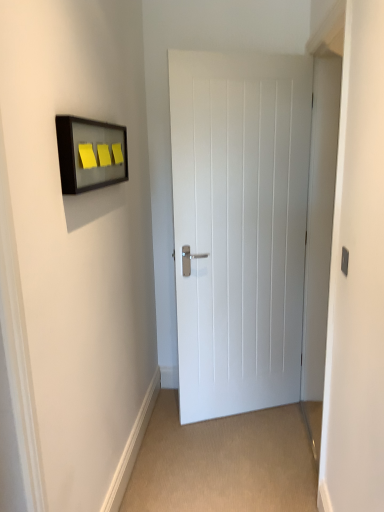
Question: Considering the relative sizes of matte glass frame at upper left and white painted wood door at center in the image provided, is matte glass frame at upper left bigger than white painted wood door at center?

Choices:
 (A) no
 (B) yes

Answer: (A)

Question: From a real-world perspective, is matte glass frame at upper left located higher than white painted wood door at center?

Choices:
 (A) yes
 (B) no

Answer: (A)

Question: Is matte glass frame at upper left located outside white painted wood door at center?

Choices:
 (A) no
 (B) yes

Answer: (B)

Question: Is white painted wood door at center completely or partially inside matte glass frame at upper left?

Choices:
 (A) no
 (B) yes

Answer: (A)

Question: Is matte glass frame at upper left oriented towards white painted wood door at center?

Choices:
 (A) yes
 (B) no

Answer: (B)

Question: Is matte gray switch at right spatially inside white painted wood door at center, or outside of it?

Choices:
 (A) inside
 (B) outside

Answer: (B)

Question: From a real-world perspective, is matte gray switch at right physically located above or below white painted wood door at center?

Choices:
 (A) below
 (B) above

Answer: (B)

Question: From the image's perspective, is matte gray switch at right positioned above or below white painted wood door at center?

Choices:
 (A) below
 (B) above

Answer: (A)

Question: Is matte gray switch at right wider or thinner than white painted wood door at center?

Choices:
 (A) thin
 (B) wide

Answer: (A)

Question: From a real-world perspective, is matte glass frame at upper left positioned above or below white painted wood door at center?

Choices:
 (A) below
 (B) above

Answer: (B)

Question: Considering the positions of matte glass frame at upper left and white painted wood door at center in the image, is matte glass frame at upper left taller or shorter than white painted wood door at center?

Choices:
 (A) short
 (B) tall

Answer: (A)

Question: Looking at the image, does matte glass frame at upper left seem bigger or smaller compared to white painted wood door at center?

Choices:
 (A) small
 (B) big

Answer: (A)

Question: In terms of width, does matte glass frame at upper left look wider or thinner when compared to white painted wood door at center?

Choices:
 (A) thin
 (B) wide

Answer: (A)

Question: Looking at their shapes, would you say white painted wood door at center is wider or thinner than matte glass frame at upper left?

Choices:
 (A) wide
 (B) thin

Answer: (A)

Question: Is point (178, 140) closer or farther from the camera than point (66, 147)?

Choices:
 (A) farther
 (B) closer

Answer: (A)